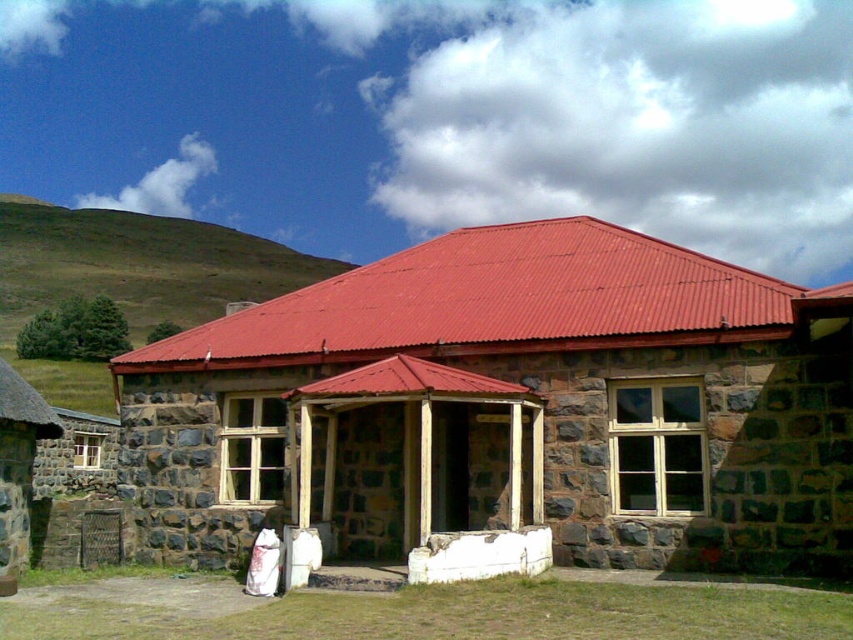
Does stone textured hut at center have a smaller size compared to green grassy hill at upper left?

Indeed, stone textured hut at center has a smaller size compared to green grassy hill at upper left.

Measure the distance from stone textured hut at center to green grassy hill at upper left.

stone textured hut at center and green grassy hill at upper left are 59.04 meters apart.

Which is behind, point (426, 260) or point (3, 273)?

The point (3, 273) is more distant.

Locate an element on the screen. This screenshot has height=640, width=853. stone textured hut at center is located at coordinates (509, 408).